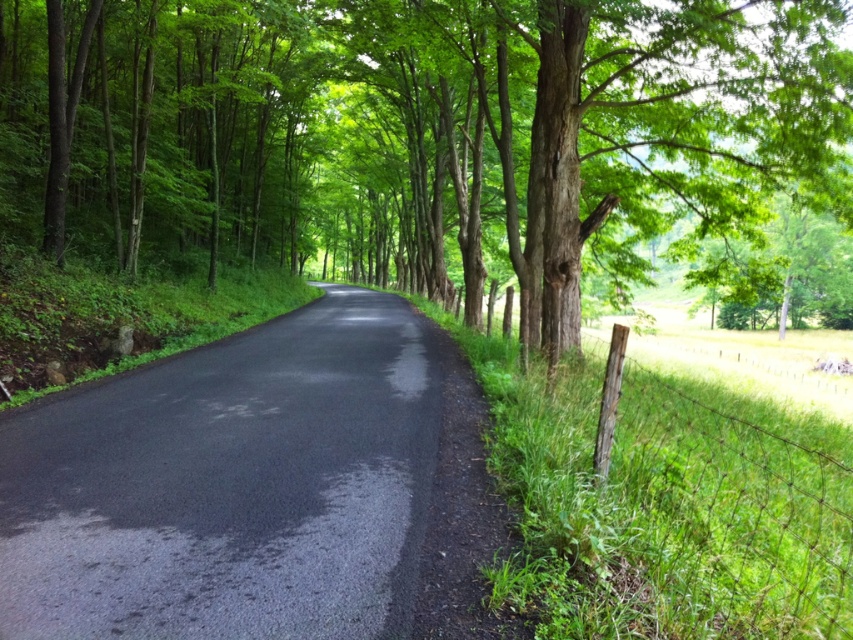
From the picture: You are standing at the point marked by point (404, 150) in the image. Looking around, what is the most prominent object directly in front of you?

The point (404, 150) marks a green leafy tree at center, so the most prominent object directly in front would be the green leafy tree at center.

In the scene shown: You are a hiker walking along the black asphalt road at center. You want to reach the green leafy tree at center. Which direction should you move to get closer to it?

The green leafy tree at center is further to the viewer than the black asphalt road at center, so you are already ahead of the tree. To reach it, you should move backward or in the opposite direction of where you are currently facing.